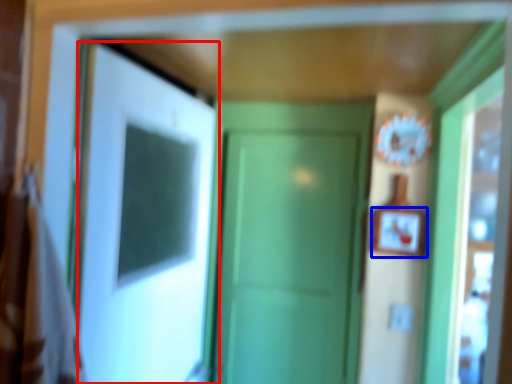
Question: Among these objects, which one is nearest to the camera, door (highlighted by a red box) or picture frame (highlighted by a blue box)?

Choices:
 (A) door
 (B) picture frame

Answer: (A)